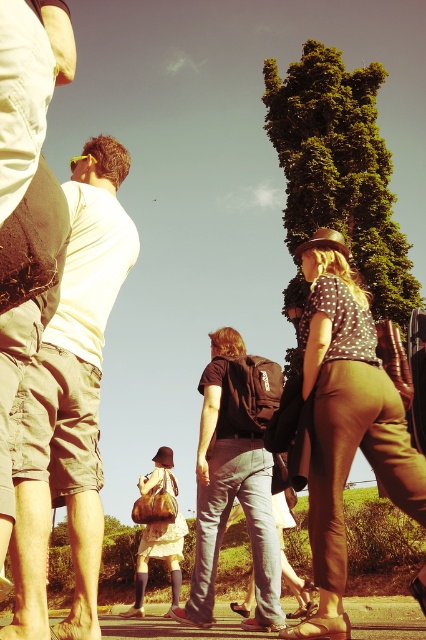
Who is more distant from viewer, (37,592) or (370,435)?

Positioned behind is point (370,435).

Measure the distance between point (109, 147) and camera.

Point (109, 147) and camera are 6.13 meters apart.

The width and height of the screenshot is (426, 640). What are the coordinates of `matte khaki shorts at left` in the screenshot? It's located at (69, 401).

Can you confirm if brown leather pants at right is wider than matte brown leather bag at center?

Indeed, brown leather pants at right has a greater width compared to matte brown leather bag at center.

Which is above, brown leather pants at right or matte brown leather bag at center?

Positioned higher is brown leather pants at right.

The image size is (426, 640). What are the coordinates of `brown leather pants at right` in the screenshot? It's located at (345, 420).

The width and height of the screenshot is (426, 640). I want to click on brown leather pants at right, so click(x=345, y=420).

Between point (103, 525) and point (195, 540), which one is positioned in front?

Point (103, 525) is more forward.

Locate an element on the screen. This screenshot has height=640, width=426. matte khaki shorts at left is located at coordinates (69, 401).